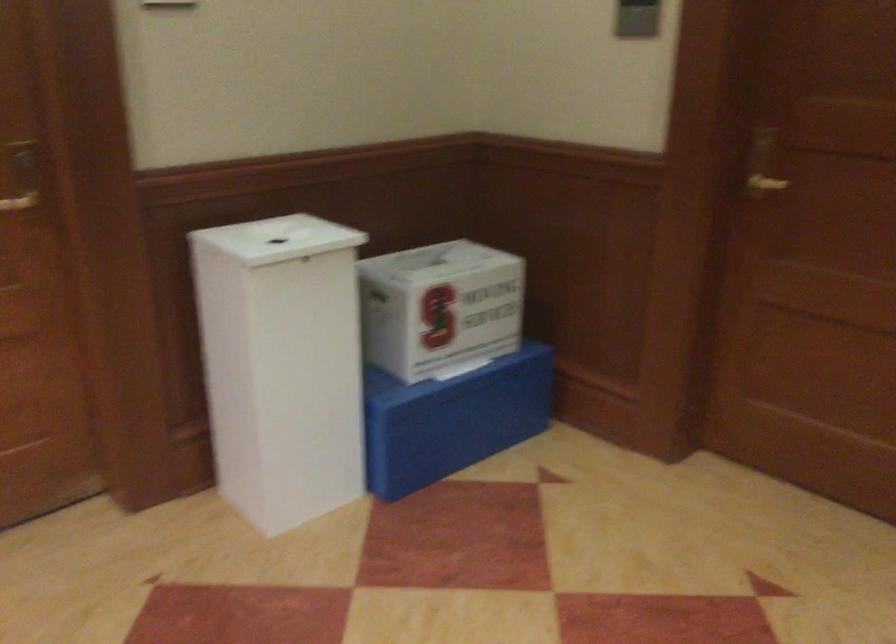
Find where to insert the bin lid slot. Please return your answer as a coordinate pair (x, y).

(277, 238)